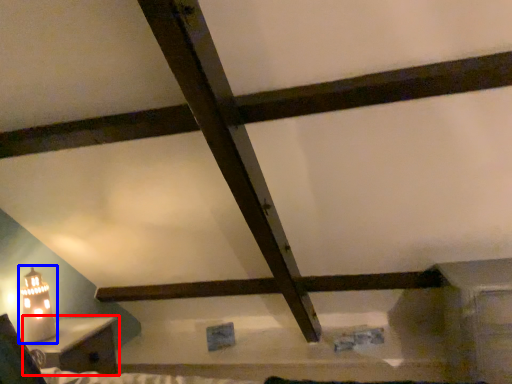
Question: Which of the following is the farthest to the observer, furniture (highlighted by a red box) or table lamp (highlighted by a blue box)?

Choices:
 (A) furniture
 (B) table lamp

Answer: (B)